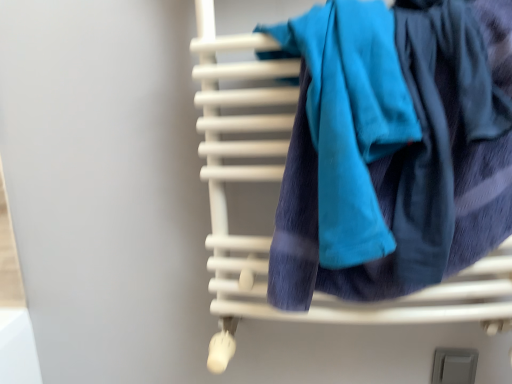
Question: Would you consider white matte towel rack at center to be distant from teal soft towel at center?

Choices:
 (A) no
 (B) yes

Answer: (A)

Question: Can you confirm if white matte towel rack at center is taller than teal soft towel at center?

Choices:
 (A) no
 (B) yes

Answer: (B)

Question: Is white matte towel rack at center located outside teal soft towel at center?

Choices:
 (A) no
 (B) yes

Answer: (B)

Question: Can you confirm if white matte towel rack at center is shorter than teal soft towel at center?

Choices:
 (A) yes
 (B) no

Answer: (B)

Question: Are white matte towel rack at center and teal soft towel at center beside each other?

Choices:
 (A) no
 (B) yes

Answer: (A)

Question: Is teal soft towel at center completely or partially inside white matte towel rack at center?

Choices:
 (A) no
 (B) yes

Answer: (B)

Question: Would you say teal soft towel at center is outside gray matte switch at lower right?

Choices:
 (A) yes
 (B) no

Answer: (A)

Question: Can you confirm if teal soft towel at center is positioned to the right of gray matte switch at lower right?

Choices:
 (A) no
 (B) yes

Answer: (A)

Question: Is teal soft towel at center with gray matte switch at lower right?

Choices:
 (A) yes
 (B) no

Answer: (B)

Question: Does teal soft towel at center have a greater height compared to gray matte switch at lower right?

Choices:
 (A) no
 (B) yes

Answer: (B)

Question: Does teal soft towel at center have a lesser height compared to gray matte switch at lower right?

Choices:
 (A) yes
 (B) no

Answer: (B)

Question: Could you tell me if teal soft towel at center is facing gray matte switch at lower right?

Choices:
 (A) no
 (B) yes

Answer: (A)

Question: Considering the relative positions of teal soft towel at center and white matte towel rack at center in the image provided, is teal soft towel at center to the right of white matte towel rack at center from the viewer's perspective?

Choices:
 (A) no
 (B) yes

Answer: (A)